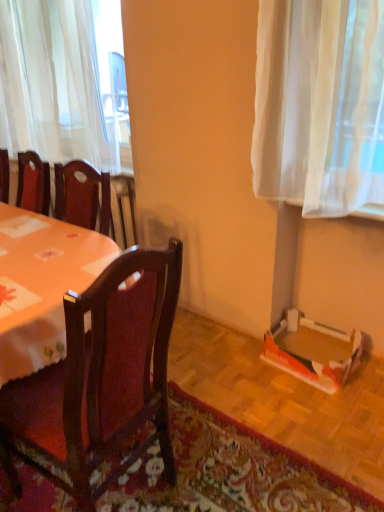
Question: Can you confirm if floral carpet at lower right is thinner than wooden table at left?

Choices:
 (A) no
 (B) yes

Answer: (A)

Question: Does floral carpet at lower right appear on the right side of wooden table at left?

Choices:
 (A) yes
 (B) no

Answer: (A)

Question: Considering the relative sizes of floral carpet at lower right and wooden table at left in the image provided, is floral carpet at lower right smaller than wooden table at left?

Choices:
 (A) no
 (B) yes

Answer: (B)

Question: Can you confirm if floral carpet at lower right is bigger than wooden table at left?

Choices:
 (A) yes
 (B) no

Answer: (B)

Question: Can you confirm if floral carpet at lower right is positioned to the left of wooden table at left?

Choices:
 (A) yes
 (B) no

Answer: (B)

Question: From the image's perspective, is orange cardboard box at lower right located above or below wooden table at left?

Choices:
 (A) below
 (B) above

Answer: (A)

Question: Is orange cardboard box at lower right in front of or behind wooden table at left in the image?

Choices:
 (A) front
 (B) behind

Answer: (B)

Question: Considering the positions of point (296, 347) and point (26, 243), is point (296, 347) closer or farther from the camera than point (26, 243)?

Choices:
 (A) farther
 (B) closer

Answer: (A)

Question: Considering the positions of orange cardboard box at lower right and wooden table at left in the image, is orange cardboard box at lower right taller or shorter than wooden table at left?

Choices:
 (A) short
 (B) tall

Answer: (A)

Question: Based on their sizes in the image, would you say dark wood chair at center is bigger or smaller than white sheer curtain at upper left?

Choices:
 (A) small
 (B) big

Answer: (B)

Question: In terms of height, does dark wood chair at center look taller or shorter compared to white sheer curtain at upper left?

Choices:
 (A) short
 (B) tall

Answer: (A)

Question: Is point (167, 282) closer or farther from the camera than point (14, 48)?

Choices:
 (A) closer
 (B) farther

Answer: (A)

Question: In the image, is dark wood chair at center on the left side or the right side of white sheer curtain at upper left?

Choices:
 (A) left
 (B) right

Answer: (B)

Question: From a real-world perspective, relative to dark wood chair at center, is floral carpet at lower right vertically above or below?

Choices:
 (A) above
 (B) below

Answer: (B)

Question: From the image's perspective, is floral carpet at lower right positioned above or below dark wood chair at center?

Choices:
 (A) above
 (B) below

Answer: (B)